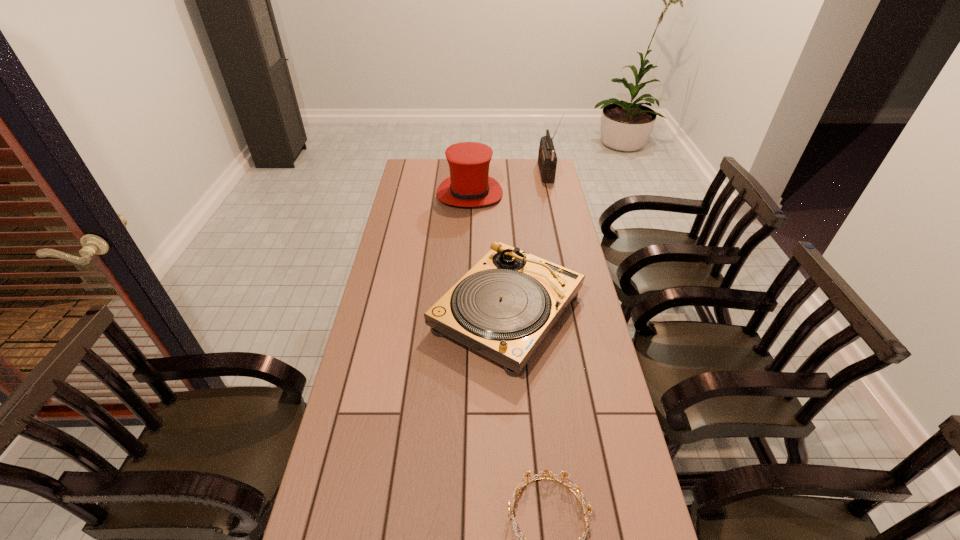
Choose which object is the nearest neighbor to the shortest object. Please provide its 2D coordinates. Your answer should be formatted as a tuple, i.e. [(x, y)], where the tuple contains the x and y coordinates of a point satisfying the conditions above.

[(506, 304)]

Locate which object ranks in proximity to the hat. Please provide its 2D coordinates. Your answer should be formatted as a tuple, i.e. [(x, y)], where the tuple contains the x and y coordinates of a point satisfying the conditions above.

[(547, 159)]

Locate an element on the screen. vacant position in the image that satisfies the following two spatial constraints: 1. on the front side of the third shortest object; 2. on the left side of the record player is located at coordinates (466, 312).